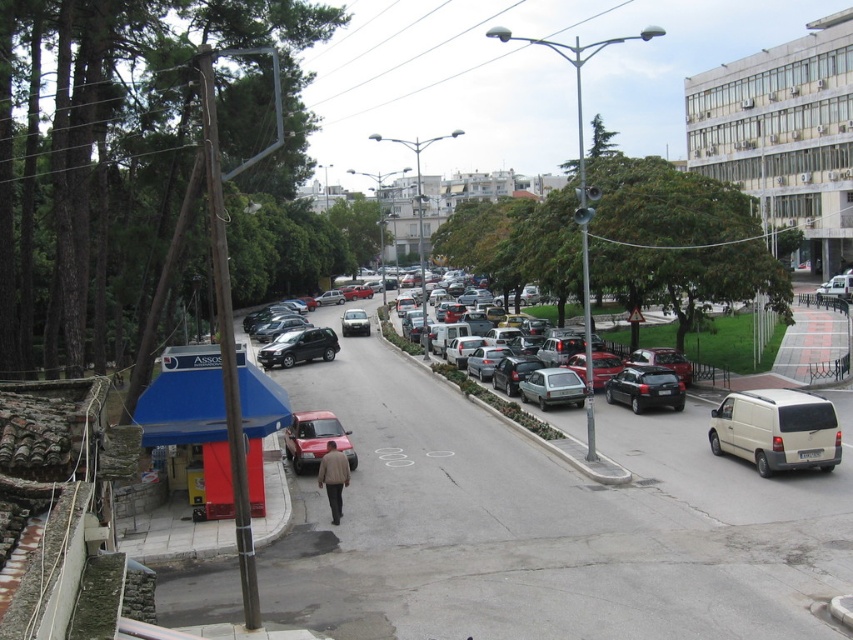
A pedestrian is walking towards the camera on the sidewalk. The point marked at coordinates point (332,342) is 146.29 feet away from the pedestrian. If the pedestrian walks at a speed of 3 feet per second, how many seconds will it take for them to reach the point?

The pedestrian is 146.29 feet away from the point marked at coordinates point (332,342). At a speed of 3 feet per second, it will take them approximately 48.76 seconds to reach the point.

You are standing at the point with coordinates point (345, 483) and want to walk to the point with coordinates point (323, 330). Which direction should you move relative to the man walking towards the camera?

You should move behind the man walking towards the camera because point (323, 330) is behind point (345, 483).